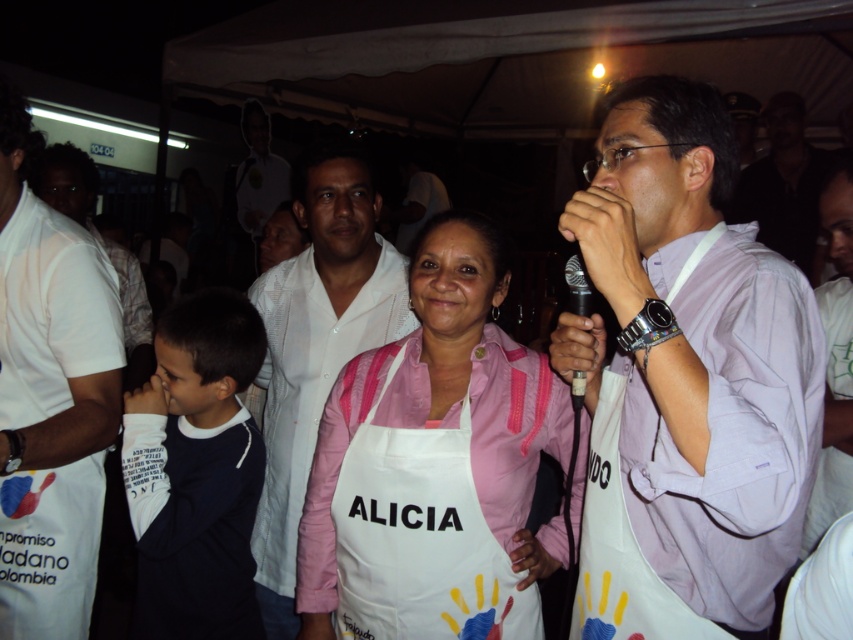
Which is behind, point (321, 513) or point (741, 182)?

Point (741, 182)

Who is more distant from viewer, (305, 625) or (799, 220)?

Positioned behind is point (799, 220).

Find the location of a particular element. pink fabric apron at center is located at coordinates (445, 417).

Can you confirm if white fabric shirt at left is positioned below white matte shirt at center?

No.

Is point (96, 326) less distant than point (393, 259)?

Yes, it is.

Where is `white fabric shirt at left`? white fabric shirt at left is located at coordinates (50, 397).

Does white fabric apron at center have a greater height compared to white matte shirt at center?

Incorrect, white fabric apron at center's height is not larger of white matte shirt at center's.

Does point (764, 401) come behind point (305, 340)?

That is False.

Locate an element on the screen. This screenshot has height=640, width=853. white fabric apron at center is located at coordinates 685,380.